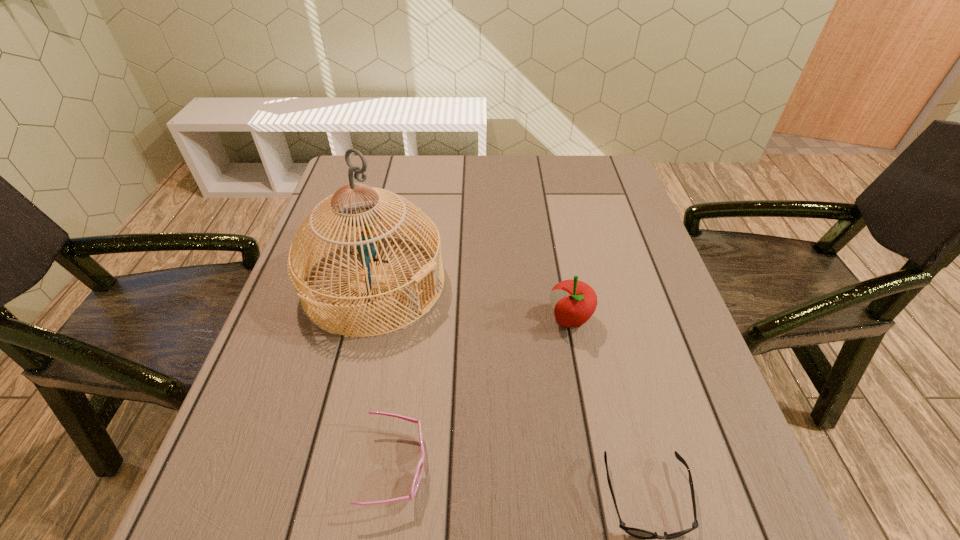
In order to click on vacant space in between the apple and the birdcage in this screenshot , I will do `click(471, 301)`.

I want to click on empty space between the third shortest object and the birdcage, so click(x=471, y=301).

In order to click on the closest object to the third tallest object in this screenshot , I will do `click(358, 214)`.

I want to click on object that stands as the second closest to the apple, so click(635, 532).

This screenshot has width=960, height=540. I want to click on free location that satisfies the following two spatial constraints: 1. on the front side of the second tallest object; 2. on the front-facing side of the second shortest object, so click(x=597, y=467).